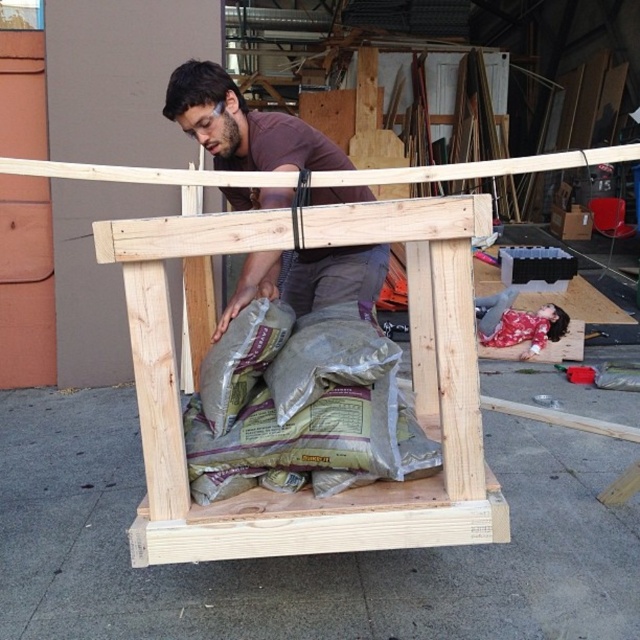
Is natural wood plank at center thinner than brown matte shirt at upper center?

In fact, natural wood plank at center might be wider than brown matte shirt at upper center.

Which is above, natural wood plank at center or brown matte shirt at upper center?

brown matte shirt at upper center

Identify the location of natural wood plank at center. (412, 378).

This screenshot has width=640, height=640. In order to click on natural wood plank at center in this screenshot , I will do `click(412, 378)`.

Is natural wood plank at center positioned before green fabric sacks at center?

Yes, it is in front of green fabric sacks at center.

Does natural wood plank at center have a greater width compared to green fabric sacks at center?

Correct, the width of natural wood plank at center exceeds that of green fabric sacks at center.

Is point (173, 515) closer to camera compared to point (307, 381)?

Yes, it is.

The height and width of the screenshot is (640, 640). I want to click on natural wood plank at center, so click(x=412, y=378).

Between green fabric sacks at center and brown matte shirt at upper center, which one has more height?

brown matte shirt at upper center is taller.

Does point (262, 442) come behind point (364, 264)?

No, it is not.

Find the location of `green fabric sacks at center`. green fabric sacks at center is located at coordinates [x=301, y=406].